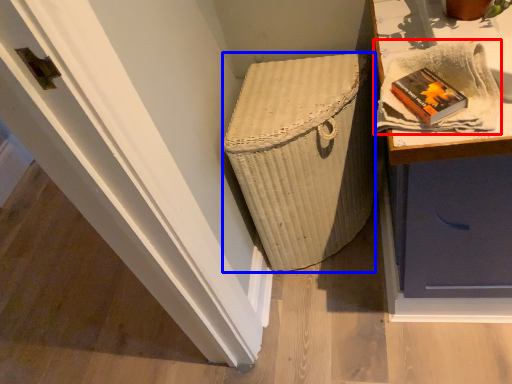
Question: Which object appears closest to the camera in this image, cloth (highlighted by a red box) or basket container (highlighted by a blue box)?

Choices:
 (A) cloth
 (B) basket container

Answer: (A)